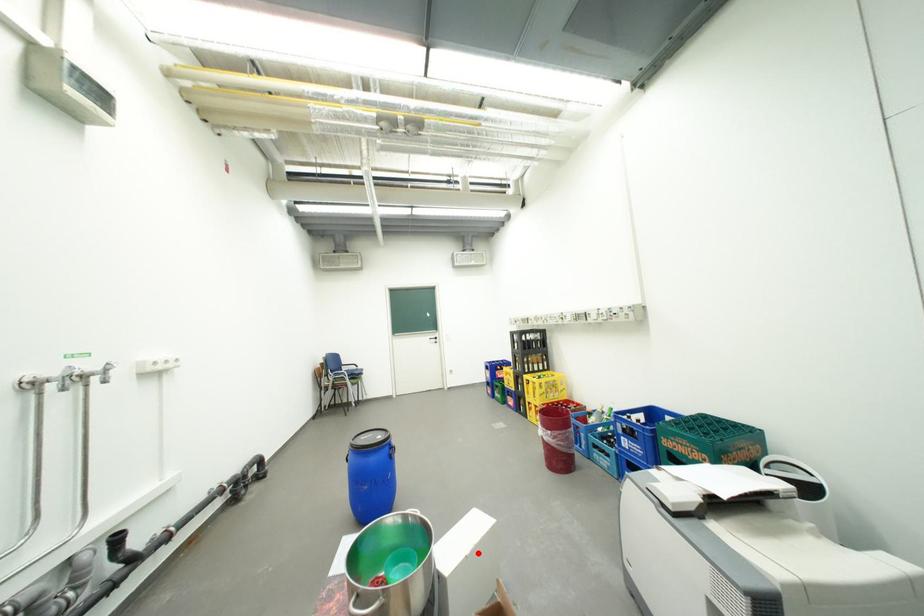
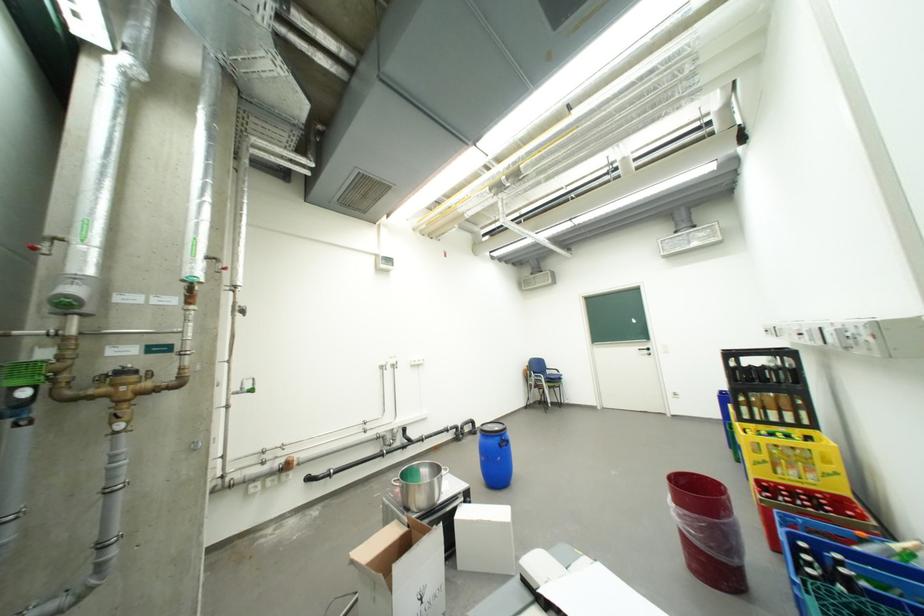
Where in the second image is the point corresponding to the highlighted location from the first image?

(484, 520)